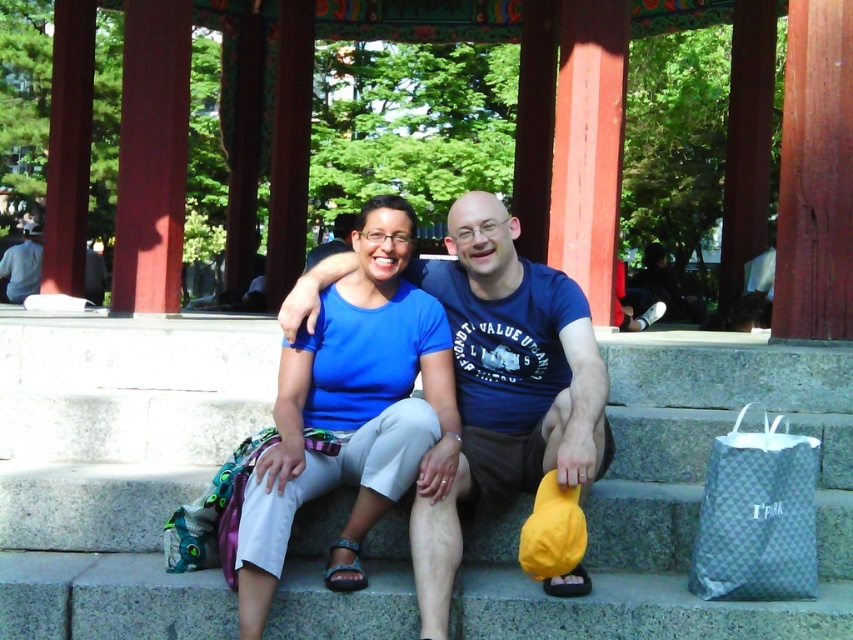
You are standing in front of the pavilion and see the two people sitting on the steps. There is a yellow cap on the step in front of them. Where is the point at coordinates [757,516] located?

The point at coordinates [757,516] is located on the gray woven fabric bag at lower right.

From the picture: You are a photographer standing at the entrance of the pavilion. You want to take a photo of the blue fabric shirt at center. Where should you position your camera to capture the shirt in the frame?

The blue fabric shirt at center is located at coordinates point (352, 412), so position your camera to aim at that point to capture it in the frame.